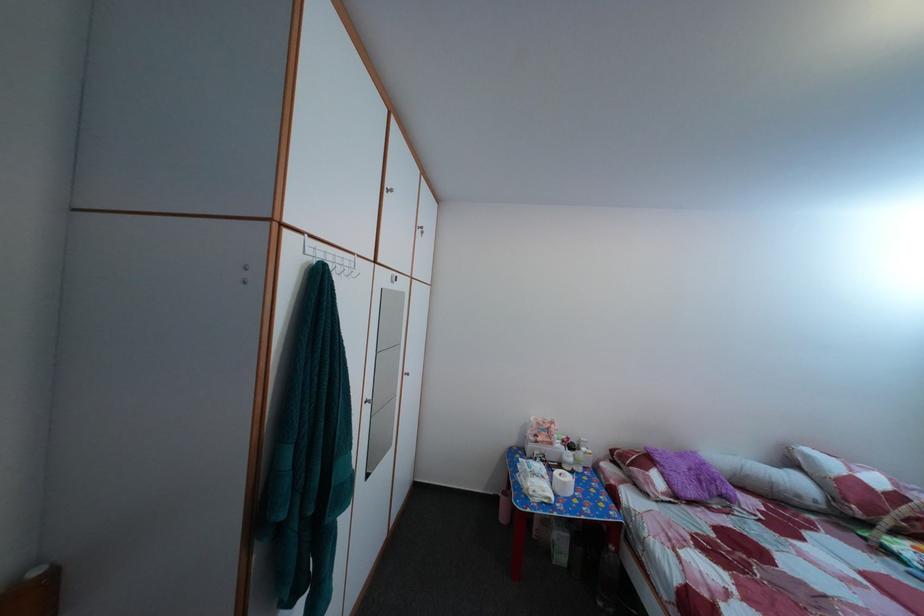
Identify the location of purple fuzzy pillow. The height and width of the screenshot is (616, 924). (690, 476).